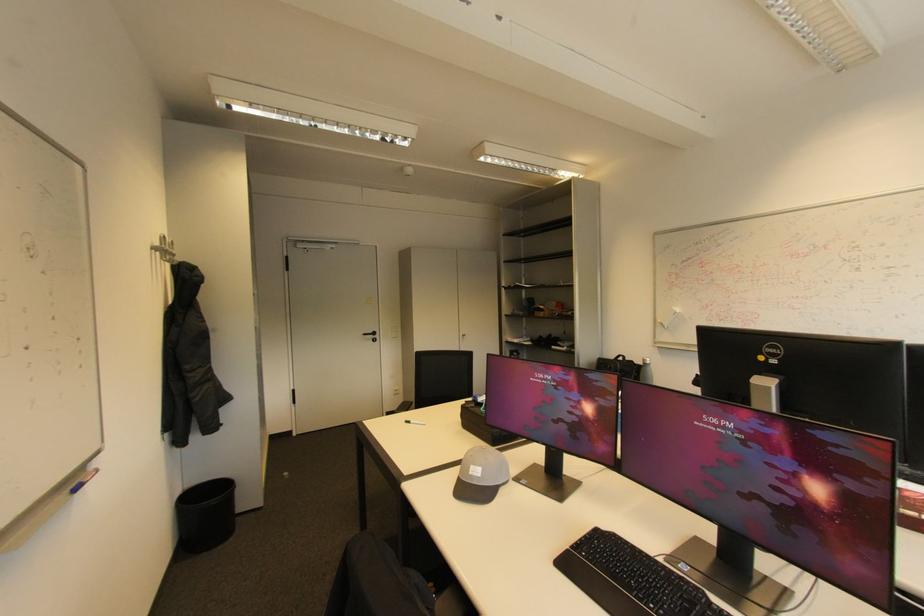
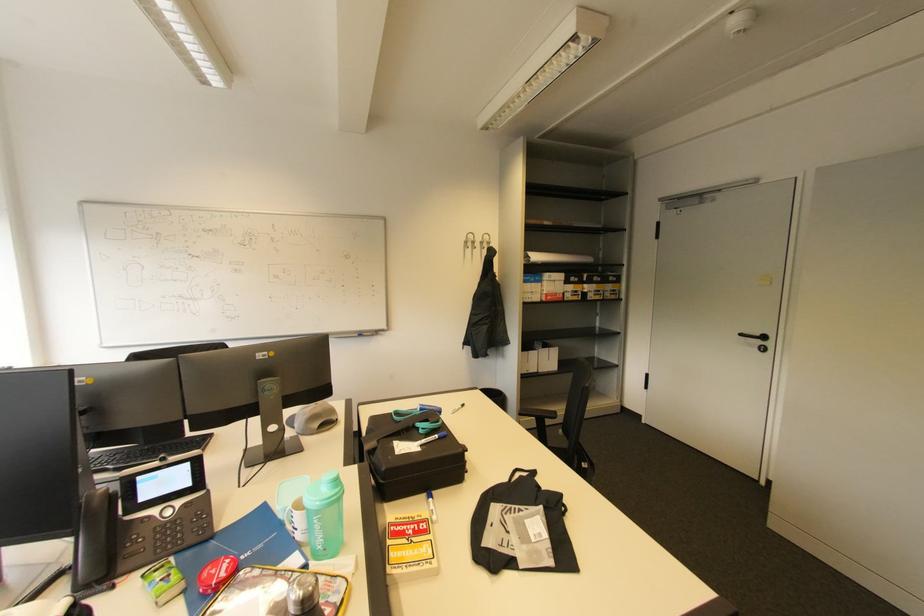
In the second image, find the point that corresponds to point (380, 334) in the first image.

(769, 339)